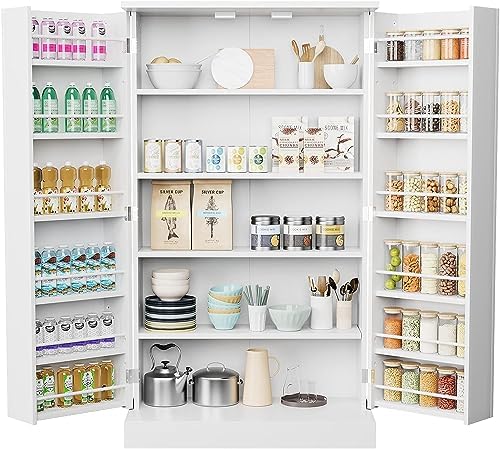
Identify the location of glass jars on the second shelf. (463, 107), (442, 103), (427, 103), (405, 103), (394, 100).